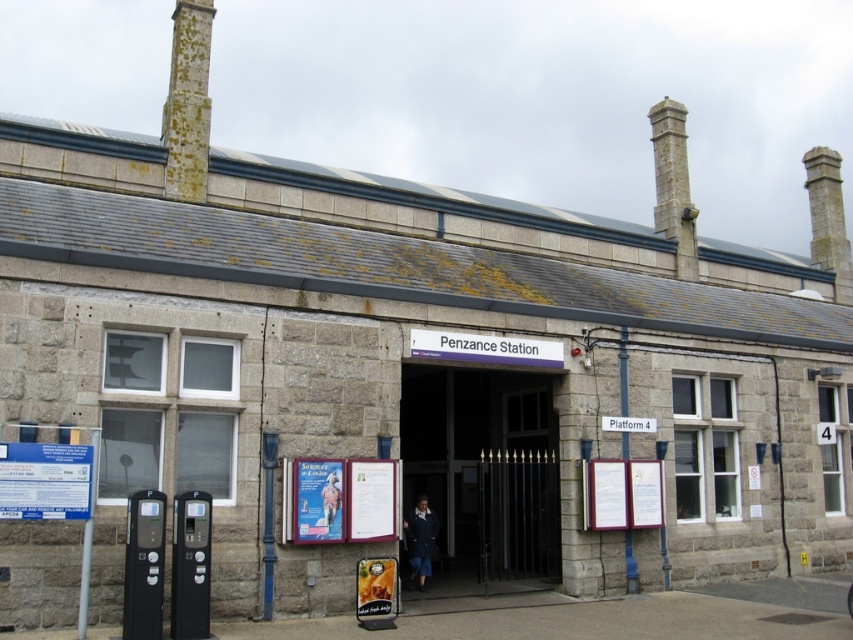
Question: Which object is farther from the camera taking this photo?

Choices:
 (A) green mossy stone chimney at upper left
 (B) smooth stone gate at center

Answer: (B)

Question: Observing the image, what is the correct spatial positioning of smooth stone gate at center in reference to green mossy stone chimney at upper left?

Choices:
 (A) below
 (B) above

Answer: (A)

Question: Among these objects, which one is nearest to the camera?

Choices:
 (A) smooth stone gate at center
 (B) green mossy stone chimney at upper left

Answer: (B)

Question: Is smooth stone gate at center to the left of green mossy stone chimney at upper left from the viewer's perspective?

Choices:
 (A) no
 (B) yes

Answer: (A)

Question: Is smooth stone gate at center to the right of green mossy stone chimney at upper left from the viewer's perspective?

Choices:
 (A) no
 (B) yes

Answer: (B)